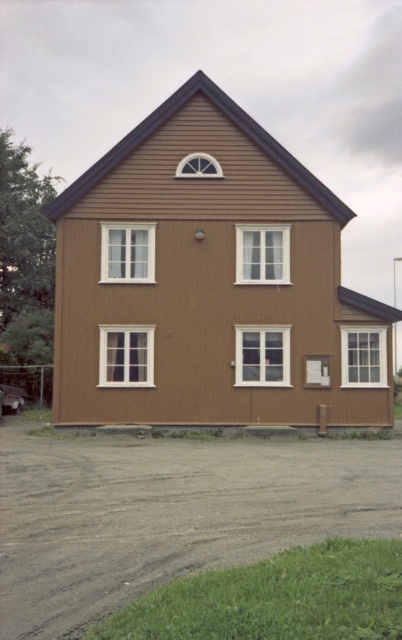
Question: Which of the following is the closest to the observer?

Choices:
 (A) dirt/gravel driveway at lower center
 (B) brown wood house at center

Answer: (A)

Question: Is brown wood house at center further to camera compared to dirt/gravel driveway at lower center?

Choices:
 (A) yes
 (B) no

Answer: (A)

Question: Where is brown wood house at center located in relation to dirt/gravel driveway at lower center in the image?

Choices:
 (A) above
 (B) below

Answer: (A)

Question: Does brown wood house at center appear under dirt/gravel driveway at lower center?

Choices:
 (A) no
 (B) yes

Answer: (A)